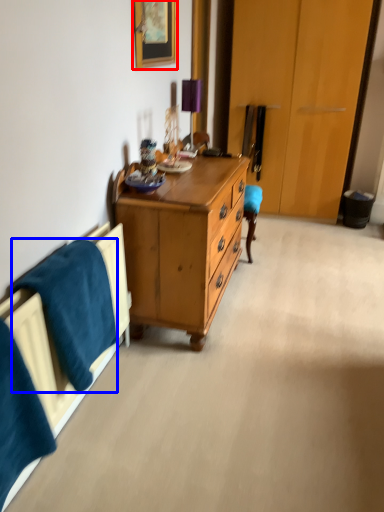
Question: Which of the following is the closest to the observer, picture frame (highlighted by a red box) or blanket (highlighted by a blue box)?

Choices:
 (A) picture frame
 (B) blanket

Answer: (B)